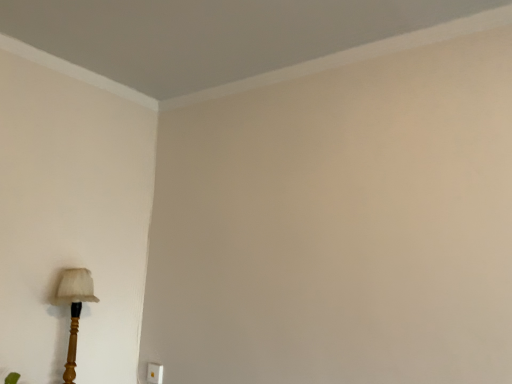
Question: Is wooden lampshade at lower left oriented towards white plastic electric outlet at lower left?

Choices:
 (A) no
 (B) yes

Answer: (A)

Question: Is wooden lampshade at lower left wider than white plastic electric outlet at lower left?

Choices:
 (A) yes
 (B) no

Answer: (A)

Question: Does wooden lampshade at lower left appear on the left side of white plastic electric outlet at lower left?

Choices:
 (A) no
 (B) yes

Answer: (B)

Question: Is wooden lampshade at lower left turned away from white plastic electric outlet at lower left?

Choices:
 (A) yes
 (B) no

Answer: (B)

Question: Does wooden lampshade at lower left lie behind white plastic electric outlet at lower left?

Choices:
 (A) yes
 (B) no

Answer: (B)

Question: From a real-world perspective, is wooden lampshade at lower left under white plastic electric outlet at lower left?

Choices:
 (A) no
 (B) yes

Answer: (A)

Question: From the image's perspective, is white plastic electric outlet at lower left over wooden lampshade at lower left?

Choices:
 (A) no
 (B) yes

Answer: (A)

Question: Does white plastic electric outlet at lower left touch wooden lampshade at lower left?

Choices:
 (A) yes
 (B) no

Answer: (B)

Question: Can you confirm if white plastic electric outlet at lower left is positioned to the right of wooden lampshade at lower left?

Choices:
 (A) yes
 (B) no

Answer: (A)

Question: From a real-world perspective, is white plastic electric outlet at lower left positioned under wooden lampshade at lower left based on gravity?

Choices:
 (A) no
 (B) yes

Answer: (B)

Question: Is white plastic electric outlet at lower left thinner than wooden lampshade at lower left?

Choices:
 (A) yes
 (B) no

Answer: (A)

Question: Considering the relative sizes of white plastic electric outlet at lower left and wooden lampshade at lower left in the image provided, is white plastic electric outlet at lower left bigger than wooden lampshade at lower left?

Choices:
 (A) yes
 (B) no

Answer: (B)

Question: In terms of size, does wooden lampshade at lower left appear bigger or smaller than white plastic electric outlet at lower left?

Choices:
 (A) small
 (B) big

Answer: (B)